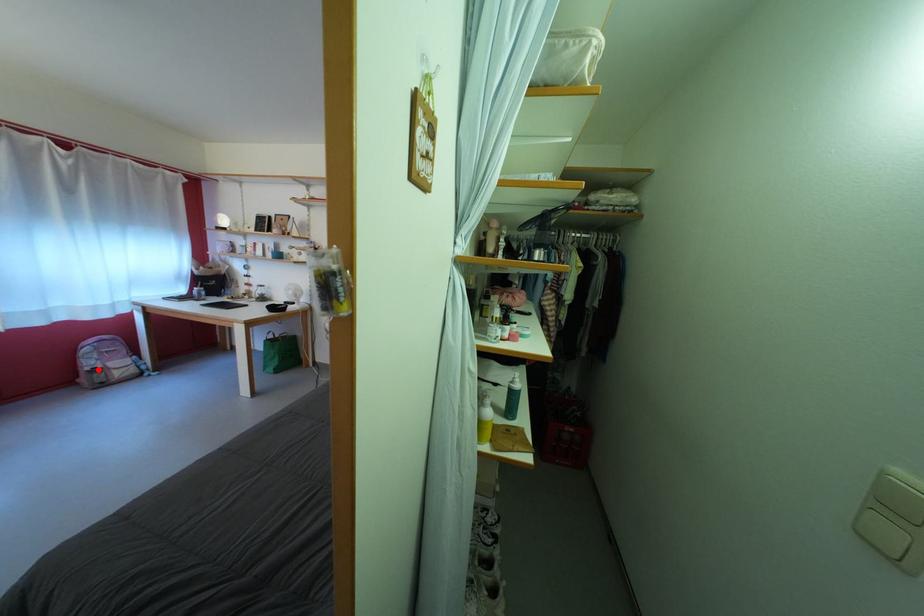
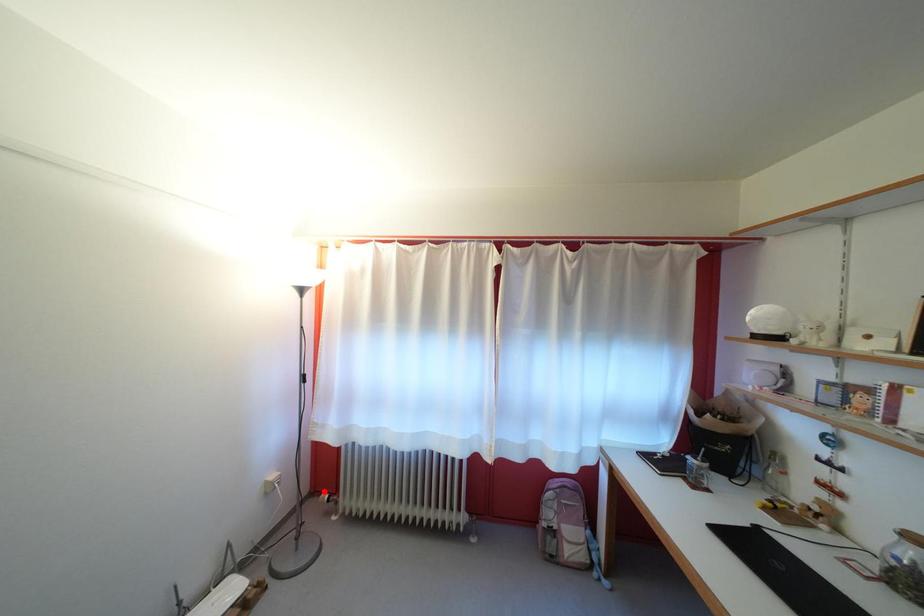
I am providing you with two images of the same scene from different viewpoints. A red point is marked on the first image and another point is marked on the second image. Do the highlighted points in image1 and image2 indicate the same real-world spot?

No